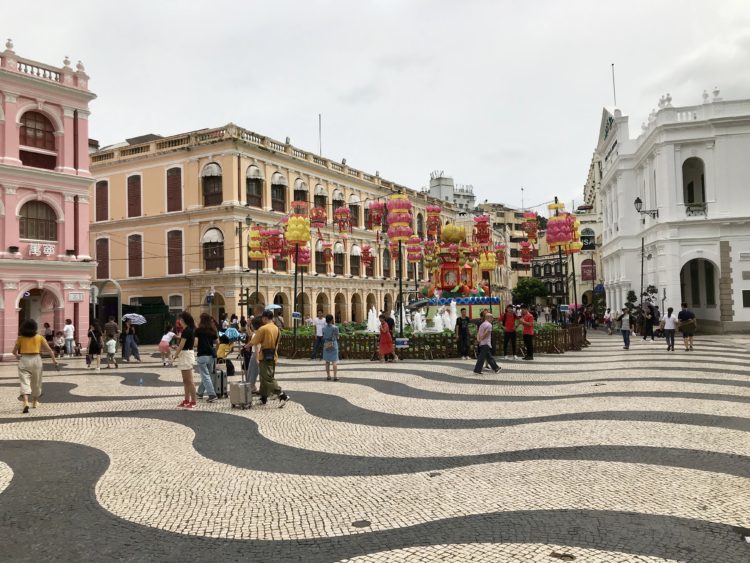
The width and height of the screenshot is (750, 563). In order to click on orange paint in this screenshot , I will do `click(200, 186)`.